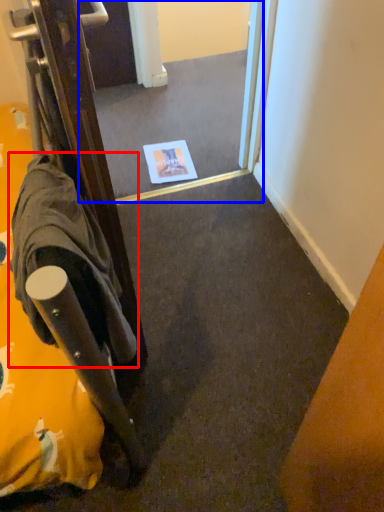
Question: Which of the following is the farthest to the observer, robe (highlighted by a red box) or mirror (highlighted by a blue box)?

Choices:
 (A) robe
 (B) mirror

Answer: (B)